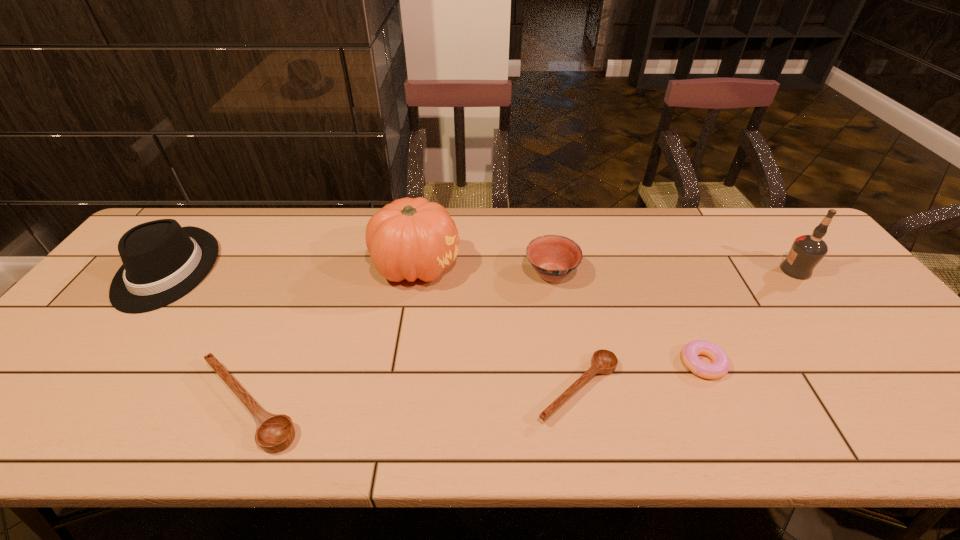
Where is `unoccupied position between the fedora and the rightmost object`? Image resolution: width=960 pixels, height=540 pixels. unoccupied position between the fedora and the rightmost object is located at coordinates (482, 270).

Find the location of a particular element. The height and width of the screenshot is (540, 960). free spot between the fourth tallest object and the doughnut is located at coordinates (627, 319).

Find the location of a particular element. The image size is (960, 540). vacant space in between the rightmost object and the taller wooden spoon is located at coordinates (522, 338).

Identify the location of free point between the shorter wooden spoon and the fourth tallest object. (564, 331).

Where is `empty space between the sixth object from left to right and the rightmost object`? empty space between the sixth object from left to right and the rightmost object is located at coordinates (x=749, y=317).

Where is `vacant space in between the doughnut and the fourth tallest object`? This screenshot has width=960, height=540. vacant space in between the doughnut and the fourth tallest object is located at coordinates (627, 319).

The height and width of the screenshot is (540, 960). Find the location of `vacant area between the pumpkin and the sixth object from left to right`. vacant area between the pumpkin and the sixth object from left to right is located at coordinates (560, 314).

This screenshot has height=540, width=960. In order to click on object that is the fourth closest to the third tallest object in this screenshot , I will do `click(604, 362)`.

You are a GUI agent. You are given a task and a screenshot of the screen. Output one action in this format:
    pyautogui.click(x=<x>, y=<y>)
    Task: Click on the second closest object relative to the vodka
    The height and width of the screenshot is (540, 960).
    Given the screenshot: What is the action you would take?
    pyautogui.click(x=553, y=257)

You are a GUI agent. You are given a task and a screenshot of the screen. Output one action in this format:
    pyautogui.click(x=<x>, y=<y>)
    Task: Click on the free point that satisfies the following two spatial constraints: 1. on the front-facing side of the doughnut; 2. on the right side of the leftmost object
    This screenshot has width=960, height=540.
    Given the screenshot: What is the action you would take?
    pyautogui.click(x=95, y=363)